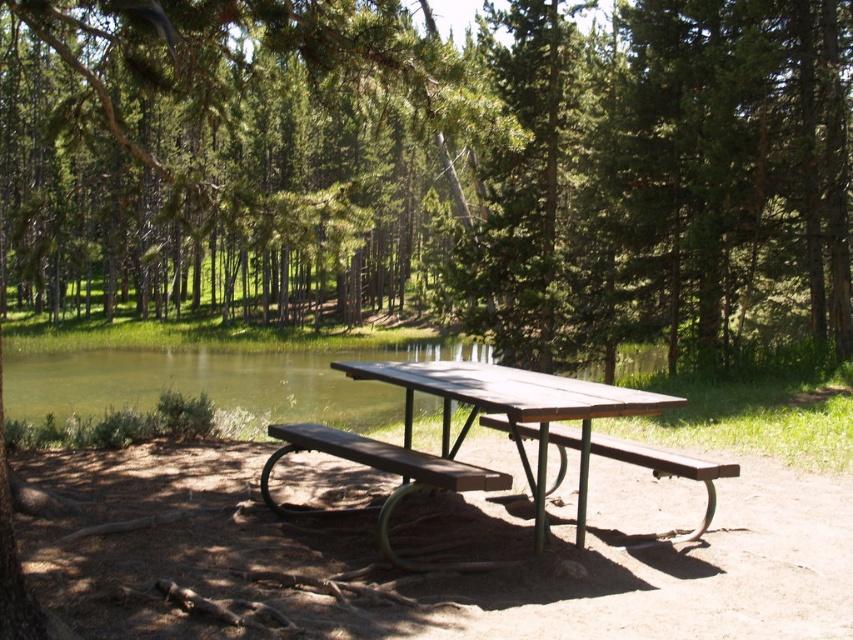
Question: Can you confirm if wooden picnic table at center is wider than wooden bench at center?

Choices:
 (A) no
 (B) yes

Answer: (A)

Question: Which object appears farthest from the camera in this image?

Choices:
 (A) wooden bench at center
 (B) wooden picnic table at center
 (C) green textured tree at center
 (D) brown wooden bench at center

Answer: (C)

Question: From the image, what is the correct spatial relationship of wooden picnic table at center in relation to brown wooden bench at center?

Choices:
 (A) left
 (B) right

Answer: (A)

Question: Which point appears closest to the camera in this image?

Choices:
 (A) (682, 173)
 (B) (618, 444)

Answer: (B)

Question: Is the position of wooden bench at center more distant than that of brown wooden bench at center?

Choices:
 (A) yes
 (B) no

Answer: (B)

Question: Which object is positioned closest to the brown wooden bench at center?

Choices:
 (A) wooden picnic table at center
 (B) green textured tree at center
 (C) wooden bench at center

Answer: (A)